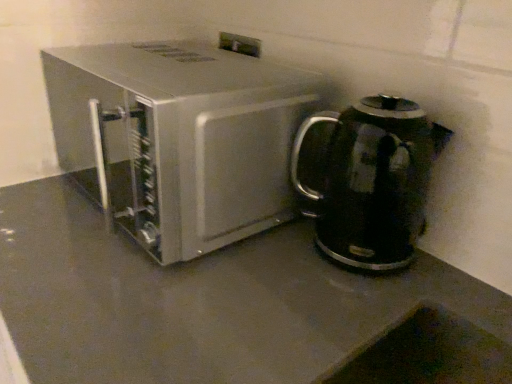
Image resolution: width=512 pixels, height=384 pixels. Identify the location of empty space that is ontop of satin silver microwave at center, acting as the second kitchen appliance starting from the right. (194, 68).